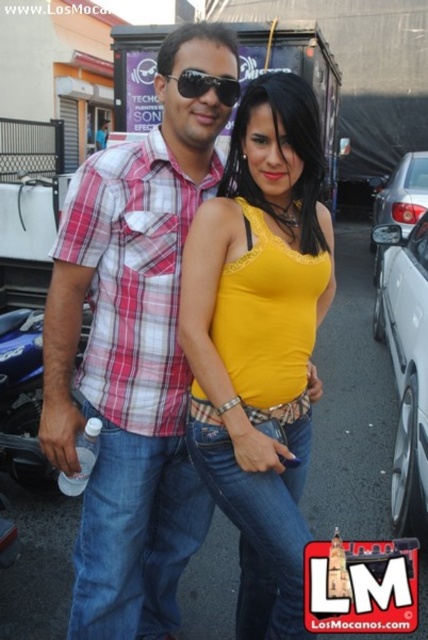
Can you confirm if plaid cotton shirt at center is thinner than blue metallic motorcycle at lower left?

No.

Which is in front, point (178, 256) or point (80, 353)?

Point (178, 256) is in front.

At what (x,y) coordinates should I click in order to perform the action: click on plaid cotton shirt at center. Please return your answer as a coordinate pair (x, y). Looking at the image, I should click on (133, 280).

Does plaid cotton shirt at center have a smaller size compared to black plastic sunglasses at upper center?

Actually, plaid cotton shirt at center might be larger than black plastic sunglasses at upper center.

Between plaid cotton shirt at center and black plastic sunglasses at upper center, which one has less height?

Standing shorter between the two is black plastic sunglasses at upper center.

Is point (192, 204) behind point (172, 76)?

Yes, point (192, 204) is behind point (172, 76).

The image size is (428, 640). In order to click on plaid cotton shirt at center in this screenshot , I will do `click(133, 280)`.

Is yellow matte tank top at center above silver metallic sedan at right?

Actually, yellow matte tank top at center is below silver metallic sedan at right.

Is point (252, 360) farther from viewer compared to point (410, 218)?

No, (252, 360) is in front of (410, 218).

Does point (226, 248) come closer to viewer compared to point (407, 204)?

That is True.

Image resolution: width=428 pixels, height=640 pixels. What are the coordinates of `yellow matte tank top at center` in the screenshot? It's located at (259, 340).